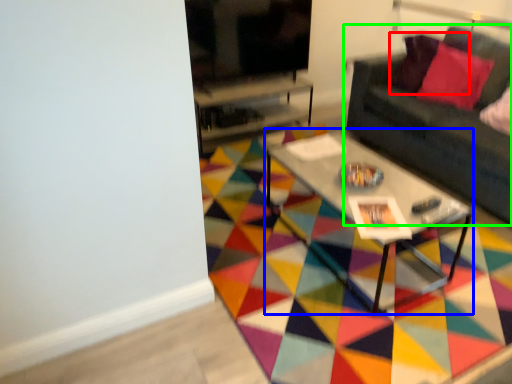
Question: Which object is positioned closest to pillow (highlighted by a red box)? Select from coffee table (highlighted by a blue box) and studio couch (highlighted by a green box).

Choices:
 (A) coffee table
 (B) studio couch

Answer: (B)